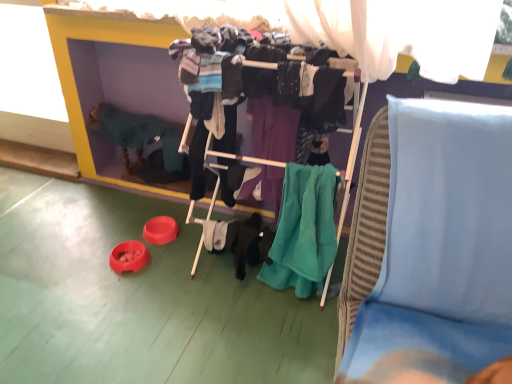
Identify the location of space that is in front of teal fabric clothes at center. The image size is (512, 384). (238, 344).